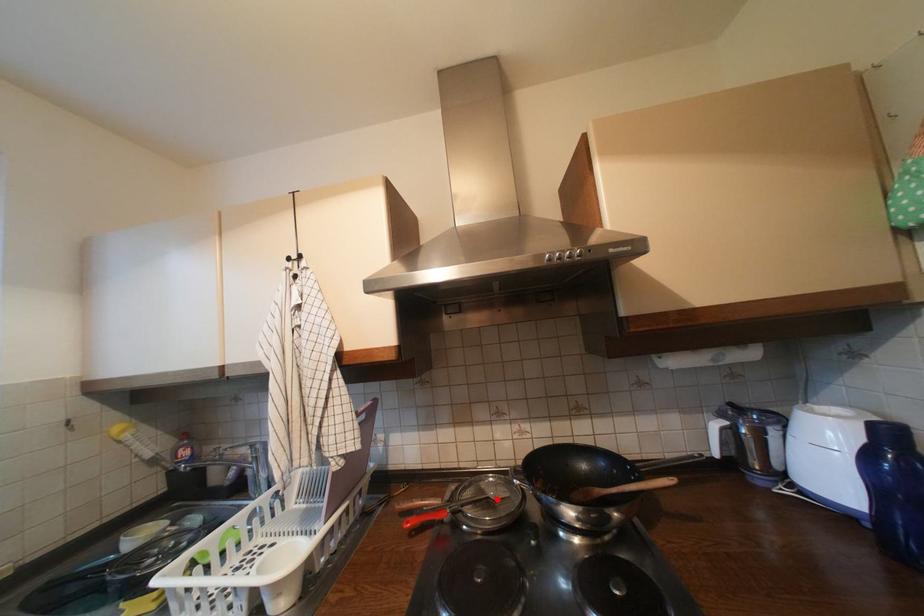
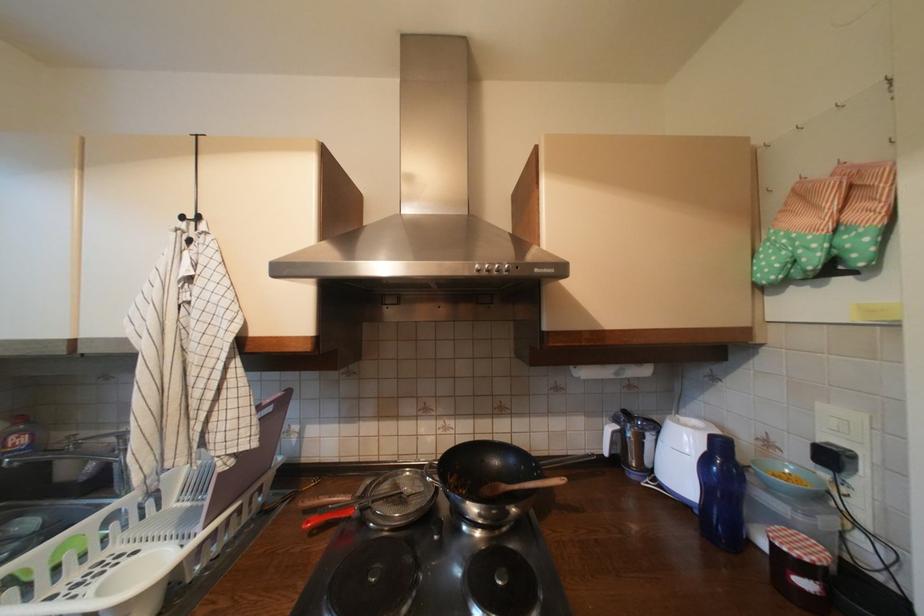
Find the pixel in the second image that matches the highlighted location in the first image.

(410, 495)